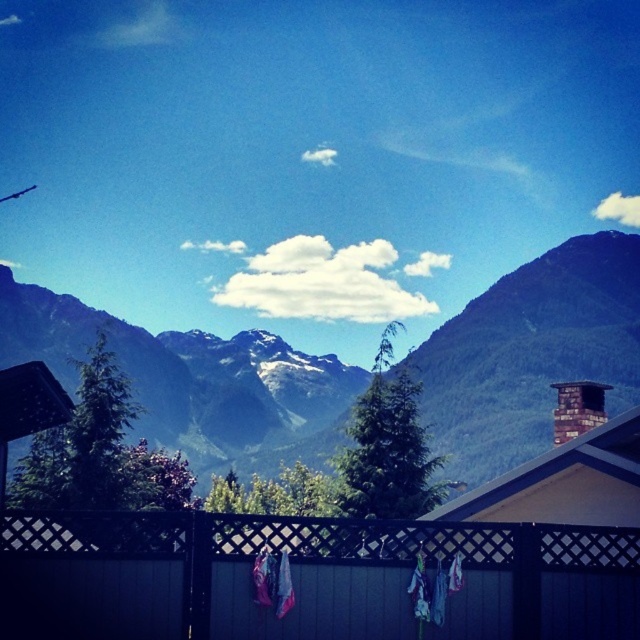
Question: Which point appears farthest from the camera in this image?

Choices:
 (A) (554, 412)
 (B) (532, 408)

Answer: (B)

Question: Does brick chimney at upper right appear under multicolored fabric at center?

Choices:
 (A) no
 (B) yes

Answer: (B)

Question: Can you confirm if black wood fence at center is positioned to the right of green textured mountain range at upper center?

Choices:
 (A) no
 (B) yes

Answer: (B)

Question: Can you confirm if green textured mountain range at upper center is positioned to the right of multicolored fabric at center?

Choices:
 (A) yes
 (B) no

Answer: (B)

Question: Which point is closer to the camera taking this photo?

Choices:
 (A) (541, 573)
 (B) (442, 618)
 (C) (586, 301)
 (D) (580, 412)

Answer: (B)

Question: Which of the following is the farthest from the observer?

Choices:
 (A) black wood fence at center
 (B) brick chimney at upper right
 (C) green textured mountain range at upper center
 (D) multicolored fabric at center

Answer: (C)